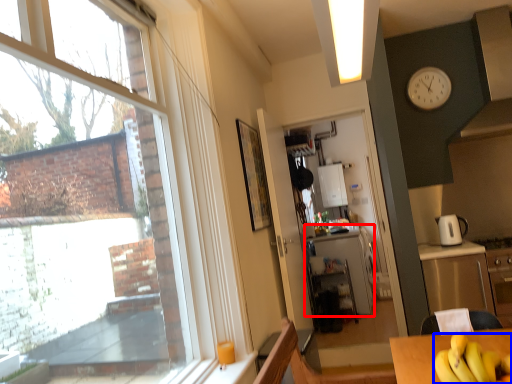
Question: Which object is further to the camera taking this photo, counter (highlighted by a red box) or banana (highlighted by a blue box)?

Choices:
 (A) counter
 (B) banana

Answer: (A)